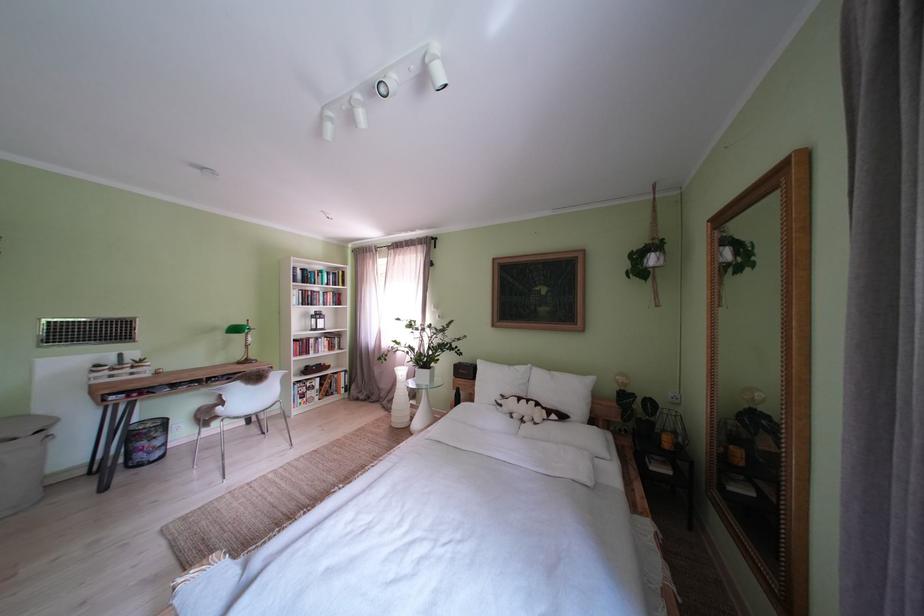
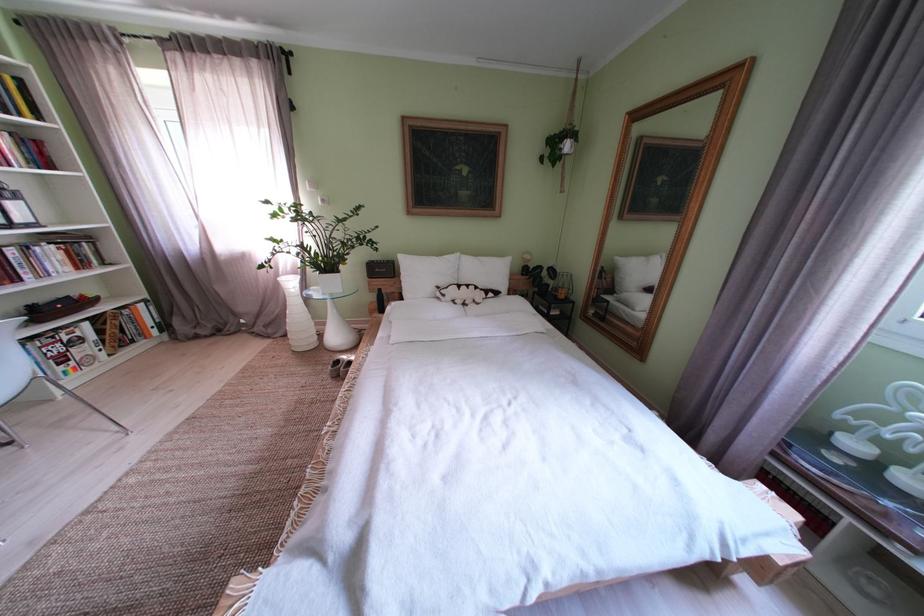
Based on the photo, the images are taken continuously from a first-person perspective. In which direction is your viewpoint rotating?

The camera's rotation is toward right-down.